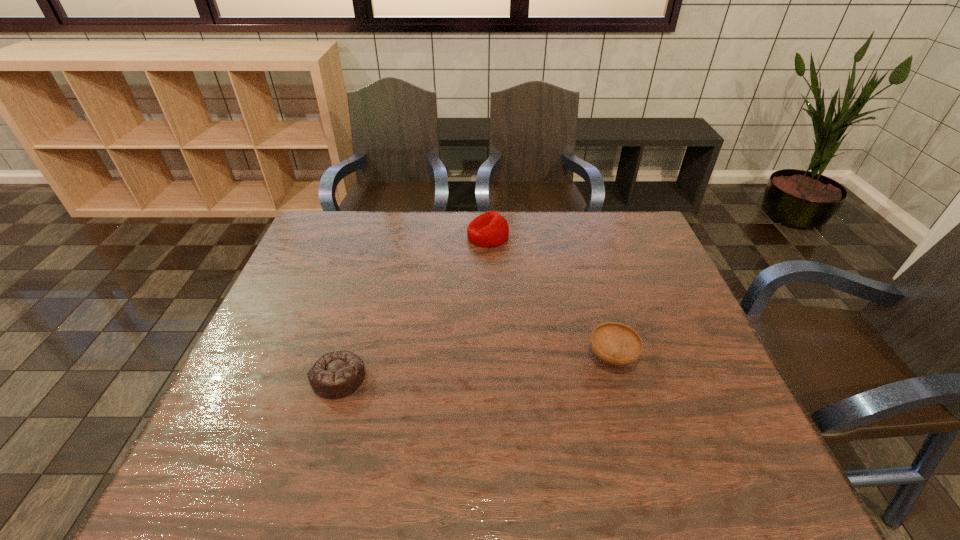
Where is `object at the far edge`? Image resolution: width=960 pixels, height=540 pixels. object at the far edge is located at coordinates (490, 229).

Image resolution: width=960 pixels, height=540 pixels. I want to click on vacant area at the far edge, so click(x=533, y=219).

Identify the location of blank space at the near edge of the desktop. (615, 474).

Identify the location of free point at the left edge. This screenshot has height=540, width=960. (279, 437).

Locate an element on the screen. The width and height of the screenshot is (960, 540). free space at the right edge of the desktop is located at coordinates (692, 351).

In the image, there is a desktop. In order to click on vacant space at the far left corner in this screenshot , I will do `click(343, 251)`.

This screenshot has height=540, width=960. Find the location of `vacant space in between the nearer beanbag and the rightmost object`. vacant space in between the nearer beanbag and the rightmost object is located at coordinates (475, 368).

This screenshot has width=960, height=540. I want to click on free space between the shorter beanbag and the farthest object, so click(414, 307).

This screenshot has height=540, width=960. Find the location of `vacant area that lies between the bowl and the taller beanbag`. vacant area that lies between the bowl and the taller beanbag is located at coordinates (550, 297).

Where is `vacant area between the second object from left to right and the leftmost object`? The image size is (960, 540). vacant area between the second object from left to right and the leftmost object is located at coordinates (414, 307).